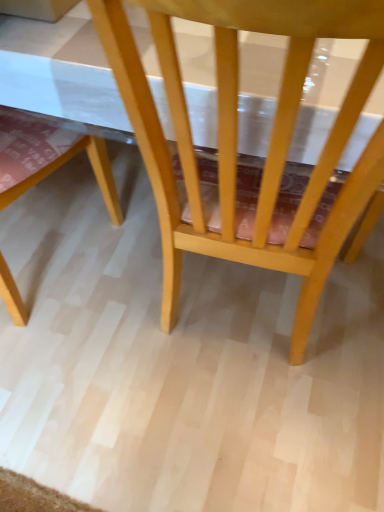
Question: From a real-world perspective, is light wood chair at center, which is the 2th chair from left to right, above or below light wood chair at lower left, the first chair from the left?

Choices:
 (A) below
 (B) above

Answer: (B)

Question: Is light wood chair at center, which is the 2th chair from left to right, in front of or behind light wood chair at lower left, the second chair in the right-to-left sequence, in the image?

Choices:
 (A) behind
 (B) front

Answer: (B)

Question: Is point (327, 29) positioned closer to the camera than point (112, 206)?

Choices:
 (A) closer
 (B) farther

Answer: (A)

Question: Is point (52, 129) positioned closer to the camera than point (228, 86)?

Choices:
 (A) closer
 (B) farther

Answer: (B)

Question: From the image's perspective, is light wood chair at lower left, the first chair from the left, positioned above or below light wood chair at center, the first chair positioned from the right?

Choices:
 (A) above
 (B) below

Answer: (B)

Question: Is light wood chair at lower left, the second chair in the right-to-left sequence, taller or shorter than light wood chair at center, the first chair positioned from the right?

Choices:
 (A) short
 (B) tall

Answer: (A)

Question: Is light wood chair at lower left, the first chair from the left, wider or thinner than light wood chair at center, which is the 2th chair from left to right?

Choices:
 (A) wide
 (B) thin

Answer: (B)